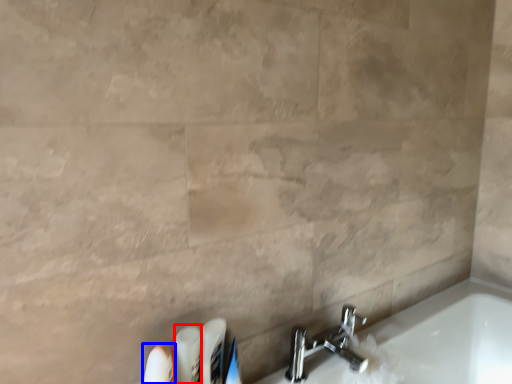
Question: Which object is further to the camera taking this photo, toiletry (highlighted by a red box) or toiletry (highlighted by a blue box)?

Choices:
 (A) toiletry
 (B) toiletry

Answer: (A)